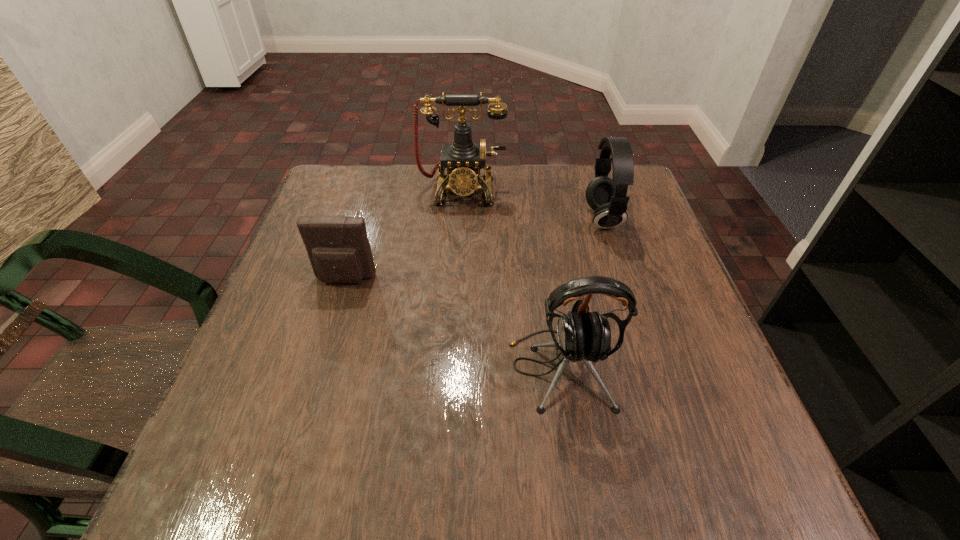
Locate an element on the screen. The height and width of the screenshot is (540, 960). free space that satisfies the following two spatial constraints: 1. on the front of the left earphone, featuring the rotary dial; 2. on the right side of the telephone is located at coordinates (452, 369).

I want to click on free location that satisfies the following two spatial constraints: 1. on the front of the telephone, featuring the rotary dial; 2. on the left side of the nearer earphone, so click(452, 369).